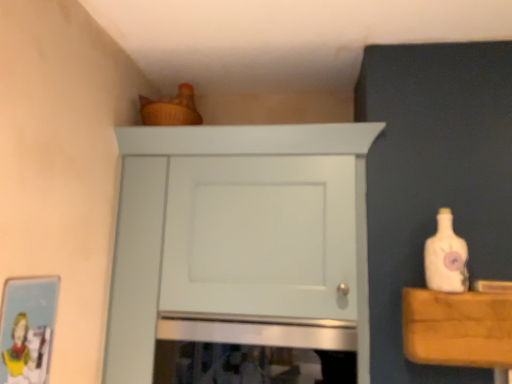
Question: Is white matte bottle at right located outside matte cardboard picture frame at lower left?

Choices:
 (A) no
 (B) yes

Answer: (B)

Question: Is white matte bottle at right to the left of matte cardboard picture frame at lower left from the viewer's perspective?

Choices:
 (A) no
 (B) yes

Answer: (A)

Question: Does white matte bottle at right turn towards matte cardboard picture frame at lower left?

Choices:
 (A) no
 (B) yes

Answer: (A)

Question: Is white matte bottle at right surrounding matte cardboard picture frame at lower left?

Choices:
 (A) yes
 (B) no

Answer: (B)

Question: From the image's perspective, is white matte bottle at right on top of matte cardboard picture frame at lower left?

Choices:
 (A) no
 (B) yes

Answer: (B)

Question: Considering the relative sizes of white matte bottle at right and matte cardboard picture frame at lower left in the image provided, is white matte bottle at right smaller than matte cardboard picture frame at lower left?

Choices:
 (A) no
 (B) yes

Answer: (A)

Question: Does white matte cabinet at upper center touch white matte bottle at right?

Choices:
 (A) yes
 (B) no

Answer: (B)

Question: Is white matte cabinet at upper center positioned before white matte bottle at right?

Choices:
 (A) no
 (B) yes

Answer: (A)

Question: Does white matte cabinet at upper center appear on the right side of white matte bottle at right?

Choices:
 (A) yes
 (B) no

Answer: (B)

Question: Are white matte cabinet at upper center and white matte bottle at right located far from each other?

Choices:
 (A) no
 (B) yes

Answer: (A)

Question: Is white matte cabinet at upper center not within white matte bottle at right?

Choices:
 (A) no
 (B) yes

Answer: (B)

Question: Considering the relative positions of white matte cabinet at upper center and white matte bottle at right in the image provided, is white matte cabinet at upper center behind white matte bottle at right?

Choices:
 (A) no
 (B) yes

Answer: (B)

Question: Is white matte cabinet at upper center aimed at matte cardboard picture frame at lower left?

Choices:
 (A) no
 (B) yes

Answer: (B)